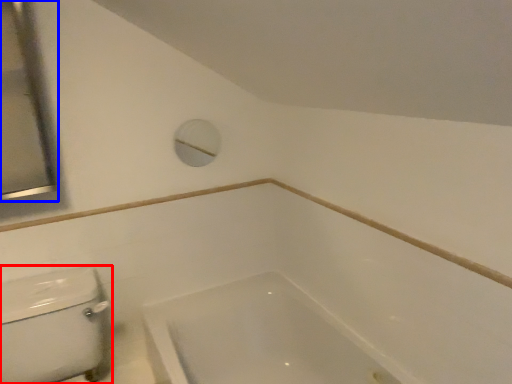
Question: Which object appears closest to the camera in this image, porcelain (highlighted by a red box) or mirror (highlighted by a blue box)?

Choices:
 (A) porcelain
 (B) mirror

Answer: (A)